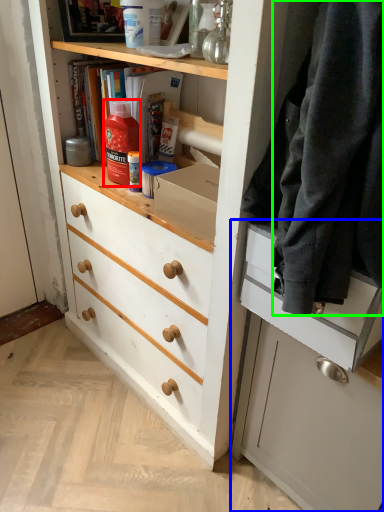
Question: Which object is the farthest from bottle (highlighted by a red box)? Choose among these: cabinetry (highlighted by a blue box) or clothing (highlighted by a green box).

Choices:
 (A) cabinetry
 (B) clothing

Answer: (A)